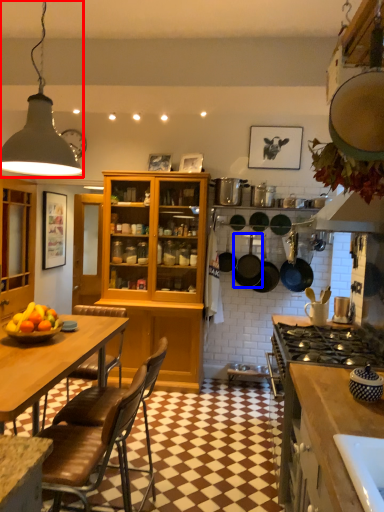
Question: Which point is closer to the camera, light fixture (highlighted by a red box) or kitchen appliance (highlighted by a blue box)?

Choices:
 (A) light fixture
 (B) kitchen appliance

Answer: (A)